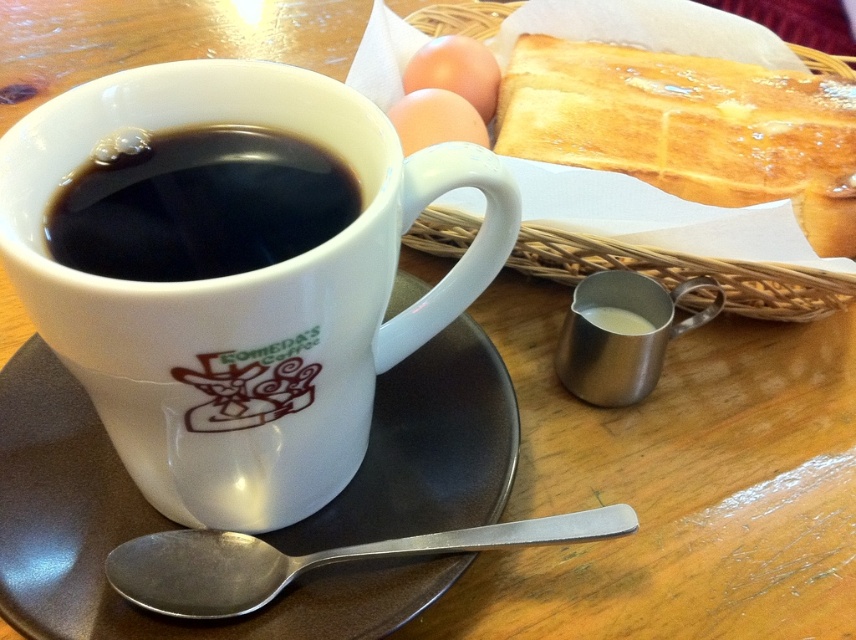
You are arranging items on a table for a breakfast photo shoot. You have a matte brown egg at center and a metallic silver creamer at upper right. According to the scene, which item is positioned higher up?

The matte brown egg at center is located above the metallic silver creamer at upper right, so it is positioned higher up.

You are a chef preparing breakfast and need to place the matte brown egg at center onto the white ceramic saucer at lower center. Can you directly place the egg on the saucer without moving any other items?

The white ceramic saucer at lower center is closer to the viewer than the matte brown egg at center, so you can directly place the egg on the saucer without needing to move other items as there is no obstruction between them.

You are a chef preparing breakfast and need to place a new dish on the table. The table is represented by the coordinate system where the bottom left corner is at point 0,0 and the top right is at 1,1. You want to place the dish so it doesn not overlap with the matte brown egg at center located at point (435,120). What coordinate should you choose for the center of the new dish?

The matte brown egg at center is located at point (435,120). To avoid overlapping, choose a coordinate that is sufficiently far away from this point, such as 0.8, 0.8.